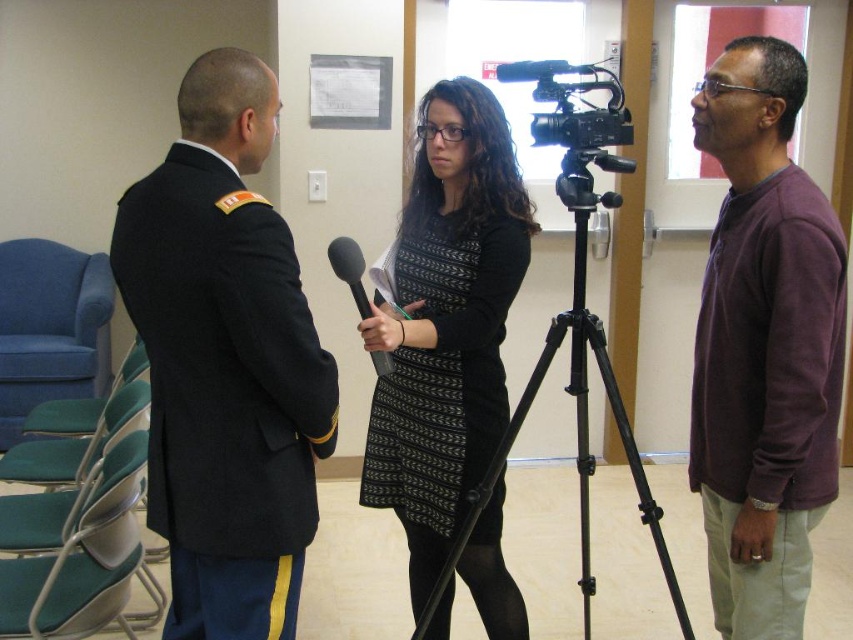
You are a photographer positioned at the back of the room near the window. You want to take a picture of the black metal tripod at center without including the black woolen jacket at left in the frame. Is this possible based on their positions?

The black woolen jacket at left is to the left of the black metal tripod at center, so if you position yourself to the right side of the tripod, you can frame the shot to exclude the jacket.

You are a photographer standing in the room. You need to adjust the distance between the black woolen jacket at left and the camera so that they are exactly 5 feet apart. Currently, they are 4.76 feet apart. How much closer or farther should you move the camera?

The black woolen jacket at left and camera are currently 4.76 feet apart. To reach exactly 5 feet, you need to move the camera 0.24 feet farther away from the black woolen jacket at left.

You are standing in the room and want to reach the point marked at coordinates point (x=296, y=513). If you can move 1.5 meters per second, how long will it take you to reach that point?

The distance between you and point (x=296, y=513) is 1.61 meters. At a speed of 1.5 meters per second, it would take approximately 1.07 seconds to reach the point.